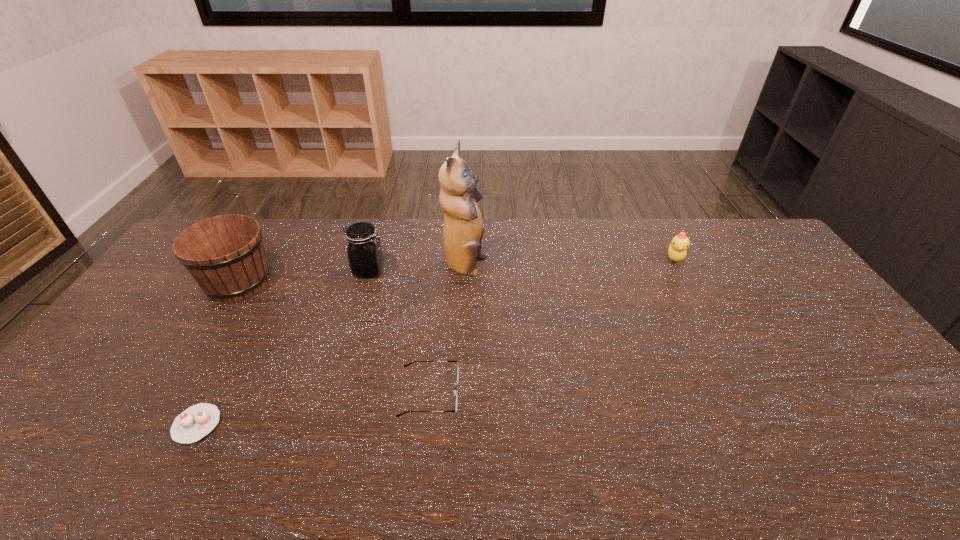
At what (x,y) coordinates should I click in order to perform the action: click on vacant space situated 0.270m on the front-facing side of the fourth tallest object. Please return your answer as a coordinate pair (x, y). The image size is (960, 540). Looking at the image, I should click on (710, 325).

At what (x,y) coordinates should I click in order to perform the action: click on vacant region located 0.180m on the lenses of the spectacles. Please return your answer as a coordinate pair (x, y). The width and height of the screenshot is (960, 540). Looking at the image, I should click on (528, 393).

Image resolution: width=960 pixels, height=540 pixels. I want to click on free space located on the left of the cupcake, so click(x=39, y=424).

Identify the location of cat that is at the far edge. (463, 231).

I want to click on duckling present at the far edge, so click(x=677, y=250).

Where is `object positioned at the near edge`? object positioned at the near edge is located at coordinates (194, 423).

You are a GUI agent. You are given a task and a screenshot of the screen. Output one action in this format:
    pyautogui.click(x=<x>, y=<y>)
    Task: Click on the object that is at the left edge
    This screenshot has height=540, width=960.
    Given the screenshot: What is the action you would take?
    pyautogui.click(x=225, y=254)

This screenshot has width=960, height=540. In order to click on vacant space at the far edge of the desktop in this screenshot , I will do `click(321, 228)`.

The image size is (960, 540). In the image, there is a desktop. Find the location of `free region at the near edge`. free region at the near edge is located at coordinates (597, 479).

This screenshot has height=540, width=960. What are the coordinates of `vacant area at the left edge of the desktop` in the screenshot? It's located at (176, 283).